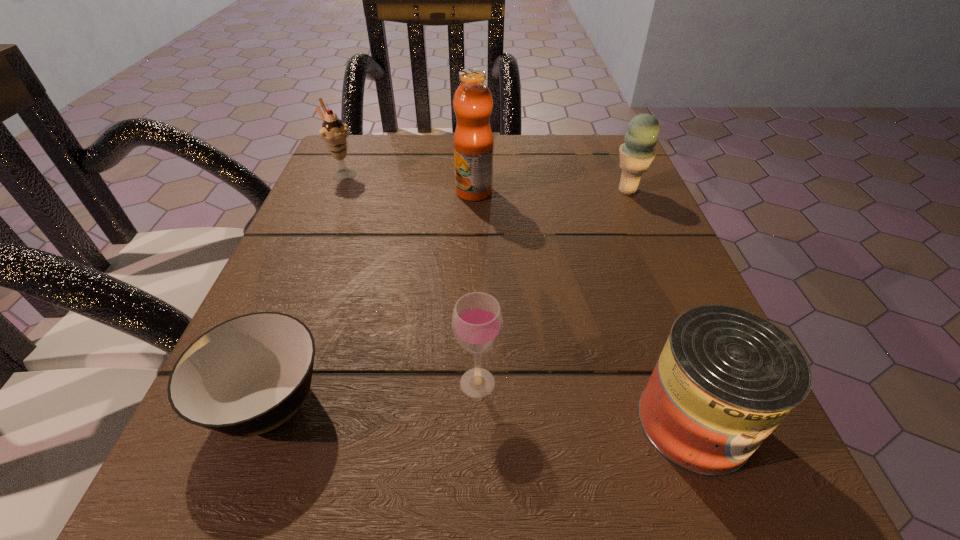
Where is `object present at the near left corner`? The width and height of the screenshot is (960, 540). object present at the near left corner is located at coordinates (248, 375).

You are a GUI agent. You are given a task and a screenshot of the screen. Output one action in this format:
    pyautogui.click(x=<x>, y=<y>)
    Task: Click on the object present at the far right corner
    The image size is (960, 540).
    Given the screenshot: What is the action you would take?
    pyautogui.click(x=636, y=154)

Image resolution: width=960 pixels, height=540 pixels. Identify the location of object at the near right corner. (726, 378).

Locate an element on the screen. The image size is (960, 540). blank space at the far edge of the desktop is located at coordinates (433, 154).

In the image, there is a desktop. Identify the location of vacant space at the near edge. (324, 497).

Where is `free spot at the left edge of the desktop`? The width and height of the screenshot is (960, 540). free spot at the left edge of the desktop is located at coordinates (369, 270).

In the image, there is a desktop. Where is `vacant space at the right edge`? This screenshot has width=960, height=540. vacant space at the right edge is located at coordinates (587, 216).

The height and width of the screenshot is (540, 960). Identify the location of vacant region at the far left corner of the desktop. (361, 186).

In the image, there is a desktop. Where is `vacant space at the near left corner`? The image size is (960, 540). vacant space at the near left corner is located at coordinates (253, 527).

Find the location of `free space at the far right corner`. free space at the far right corner is located at coordinates (571, 183).